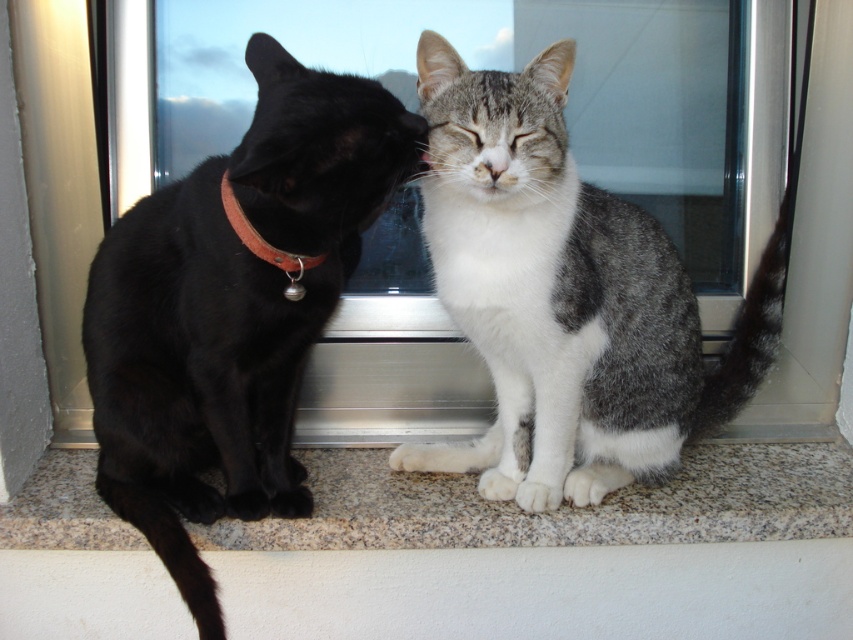
Is transparent plastic screen door at left below orange suede collar at left?

No.

Is transparent plastic screen door at left smaller than orange suede collar at left?

No, transparent plastic screen door at left is not smaller than orange suede collar at left.

Locate an element on the screen. The height and width of the screenshot is (640, 853). transparent plastic screen door at left is located at coordinates (59, 189).

Which is more to the right, shiny black cat at left or transparent plastic screen door at left?

shiny black cat at left

What do you see at coordinates (233, 308) in the screenshot?
I see `shiny black cat at left` at bounding box center [233, 308].

Identify the location of shiny black cat at left. (233, 308).

Is granite at lower center above transparent plastic screen door at left?

No, granite at lower center is not above transparent plastic screen door at left.

Locate an element on the screen. The width and height of the screenshot is (853, 640). granite at lower center is located at coordinates (548, 552).

The height and width of the screenshot is (640, 853). I want to click on granite at lower center, so click(548, 552).